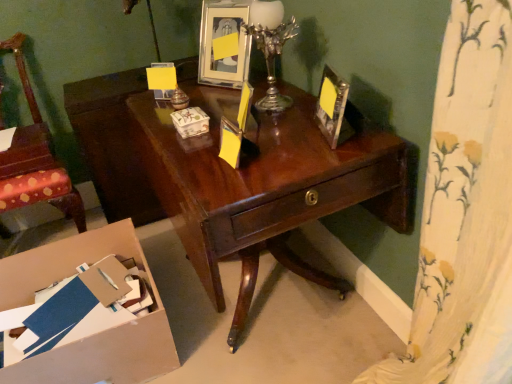
Locate an element on the screen. The height and width of the screenshot is (384, 512). vacant space underneath shiny dark wood desk at center (from a real-world perspective) is located at coordinates (273, 309).